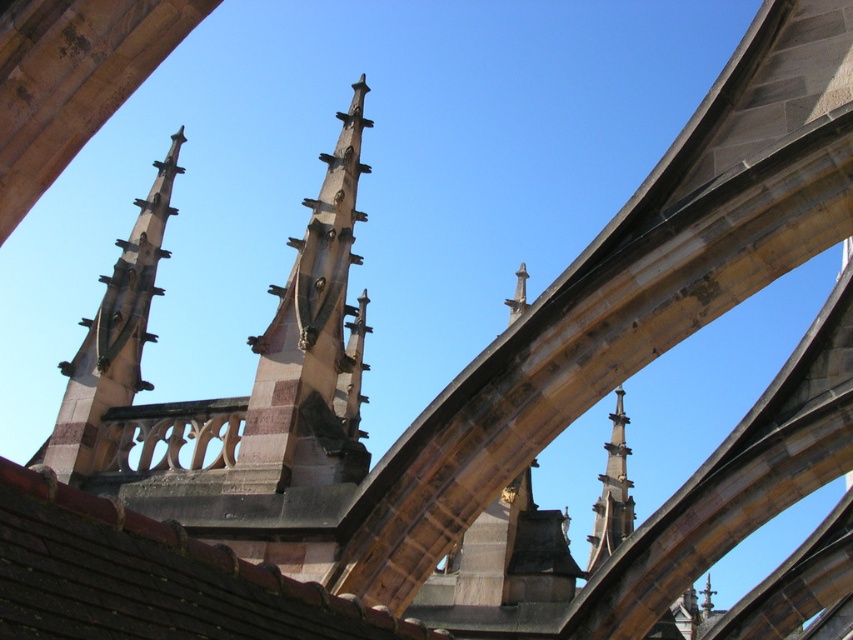
You are an architect analyzing the Gothic cathedral structure. You notice two spires in the image. Which spire, the brown stone spire at center or the smooth stone spire at center, is bigger in size?

The brown stone spire at center has a larger size compared to the smooth stone spire at center, so the brown stone spire at center is bigger.

You are standing at the base of the Gothic structure and want to take a photo of the brown stone spire at center. If your camera can focus on objects up to 200 feet away, will it be able to capture the spire clearly?

The brown stone spire at center is 222.96 feet away from the camera, which exceeds the camera maximum focus distance of 200 feet. Therefore, the camera will not be able to capture the spire clearly.